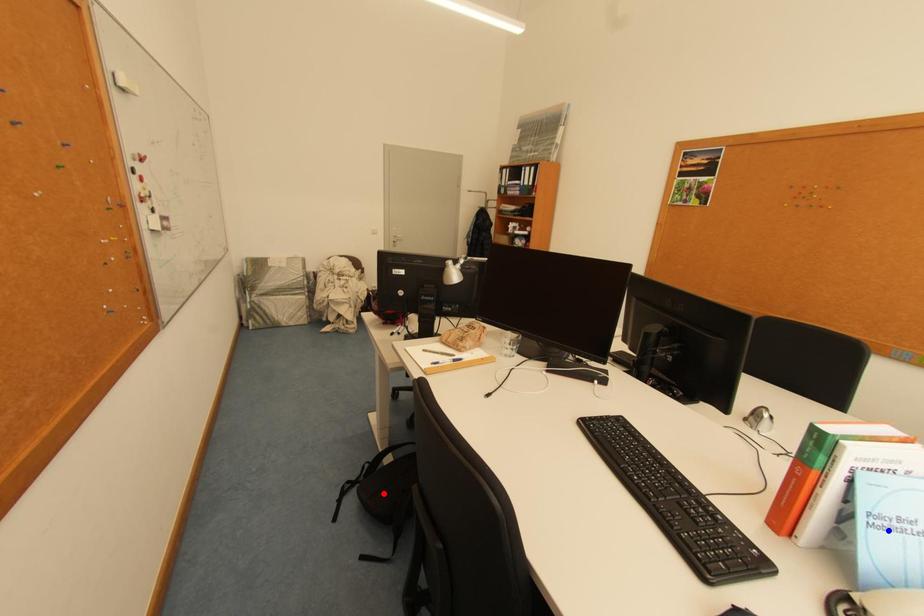
Question: Which of the two points in the image is closer to the camera?

Choices:
 (A) Blue point is closer.
 (B) Red point is closer.

Answer: (A)